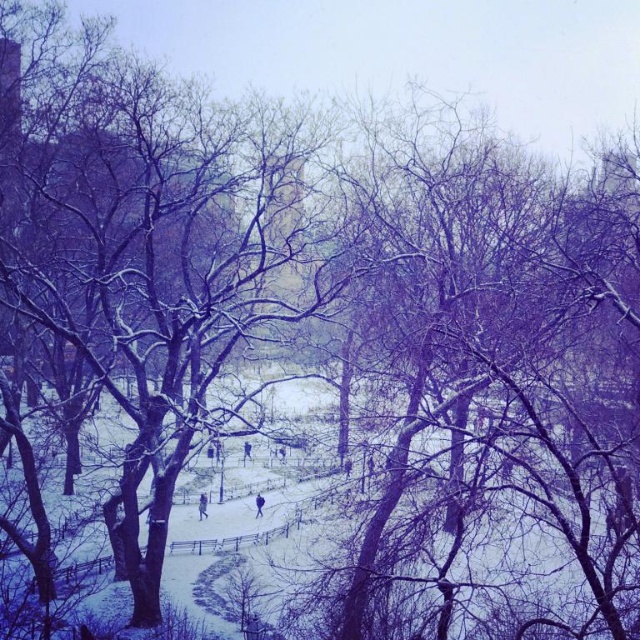
Question: Can you confirm if purple fabric person at lower center is smaller than blue fabric jacket at center?

Choices:
 (A) no
 (B) yes

Answer: (B)

Question: Which object appears closest to the camera in this image?

Choices:
 (A) purple fabric person at lower center
 (B) blue fabric jacket at center

Answer: (B)

Question: Does purple fabric person at lower center appear on the left side of blue fabric jacket at center?

Choices:
 (A) no
 (B) yes

Answer: (B)

Question: Is purple fabric person at lower center to the right of blue fabric jacket at center from the viewer's perspective?

Choices:
 (A) yes
 (B) no

Answer: (B)